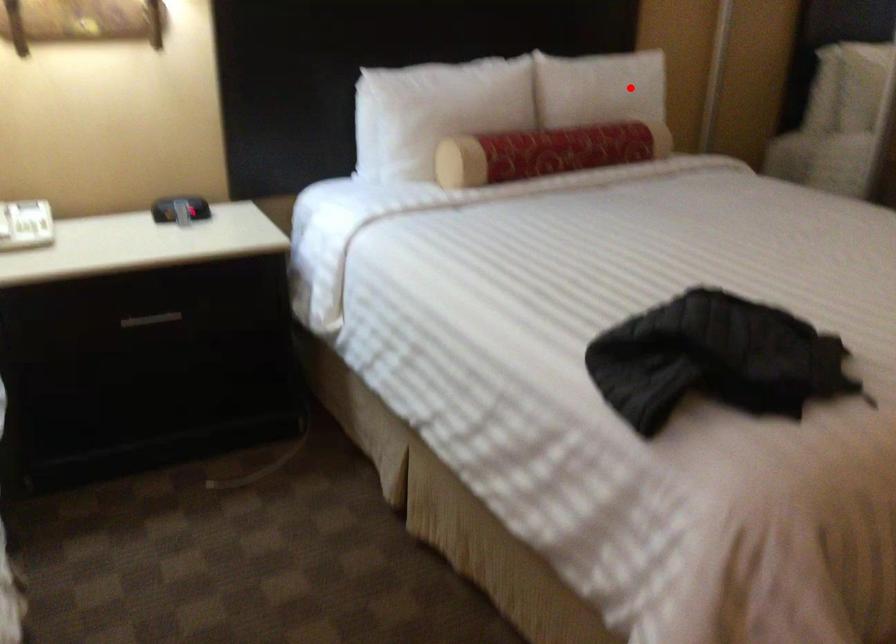
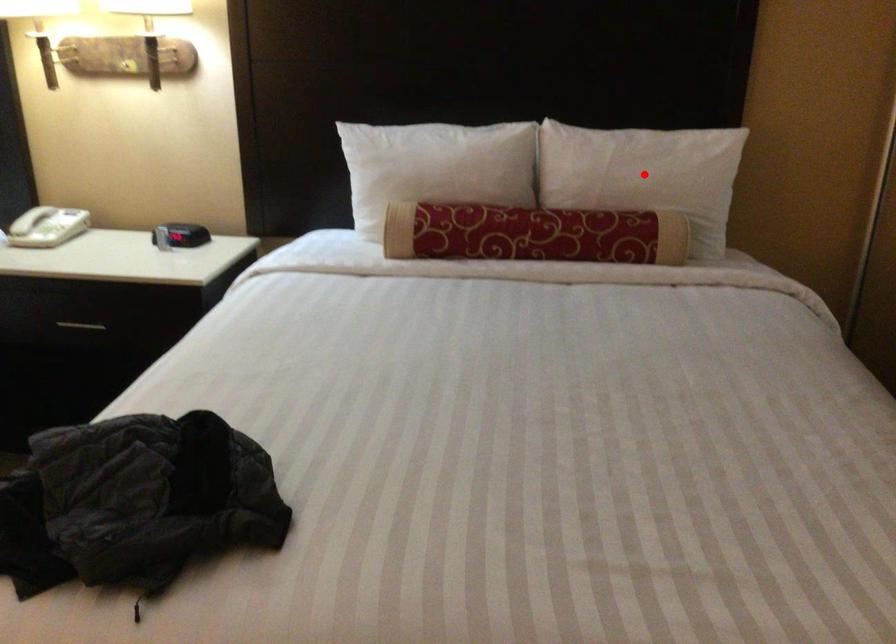
I am providing you with two images of the same scene from different viewpoints. A red point is marked on the first image and another point is marked on the second image. Are the points marked in image1 and image2 representing the same 3D position?

Yes